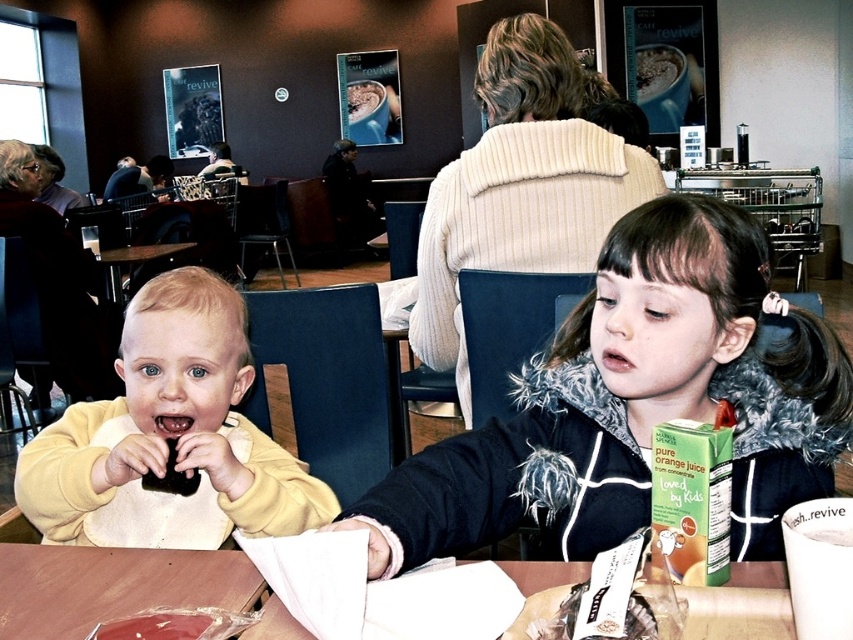
Question: Can you confirm if wooden table at lower left is thinner than smooth chocolate cake at center?

Choices:
 (A) no
 (B) yes

Answer: (B)

Question: Considering the real-world distances, which object is farthest from the fluffy black jacket at center?

Choices:
 (A) smooth chocolate cake at center
 (B) wooden table at lower left
 (C) yellow fleece bib at center

Answer: (A)

Question: Which object is positioned farthest from the yellow fleece bib at center?

Choices:
 (A) wooden table at lower left
 (B) smooth chocolate cake at center
 (C) fluffy black jacket at center
 (D) white paper bag at lower center

Answer: (B)

Question: Which object appears closest to the camera in this image?

Choices:
 (A) wooden table at lower left
 (B) yellow fleece bib at center
 (C) shiny plastic bag at table front

Answer: (C)

Question: Does fluffy black jacket at center appear on the right side of white paper bag at lower center?

Choices:
 (A) yes
 (B) no

Answer: (A)

Question: Does fluffy black jacket at center appear on the left side of wooden table at lower left?

Choices:
 (A) no
 (B) yes

Answer: (A)